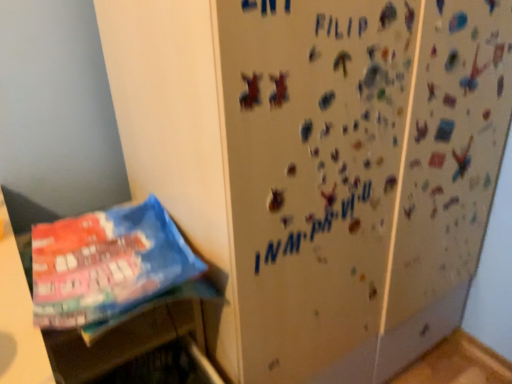
Where is `free location above blue paper at left (from a real-world perspective)`? This screenshot has width=512, height=384. free location above blue paper at left (from a real-world perspective) is located at coordinates (112, 289).